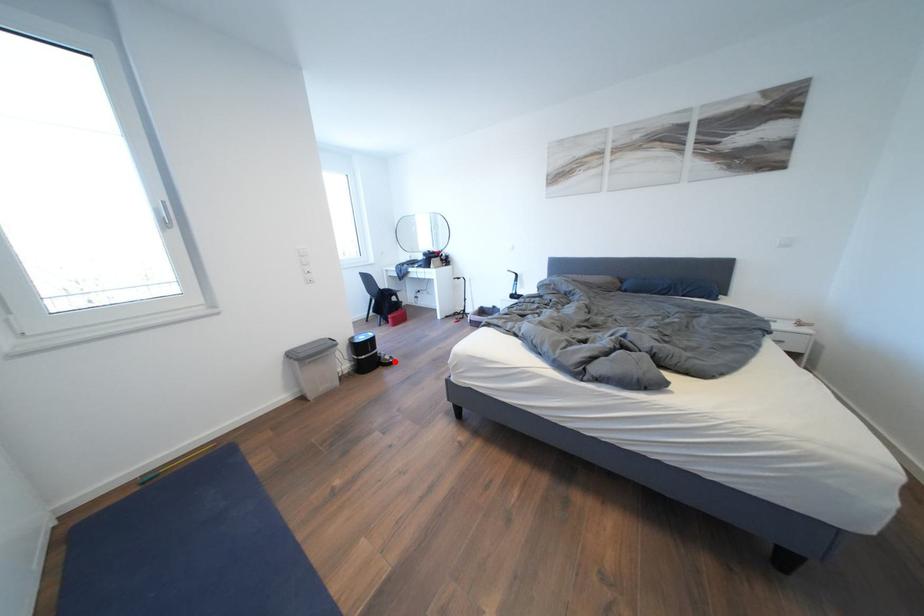
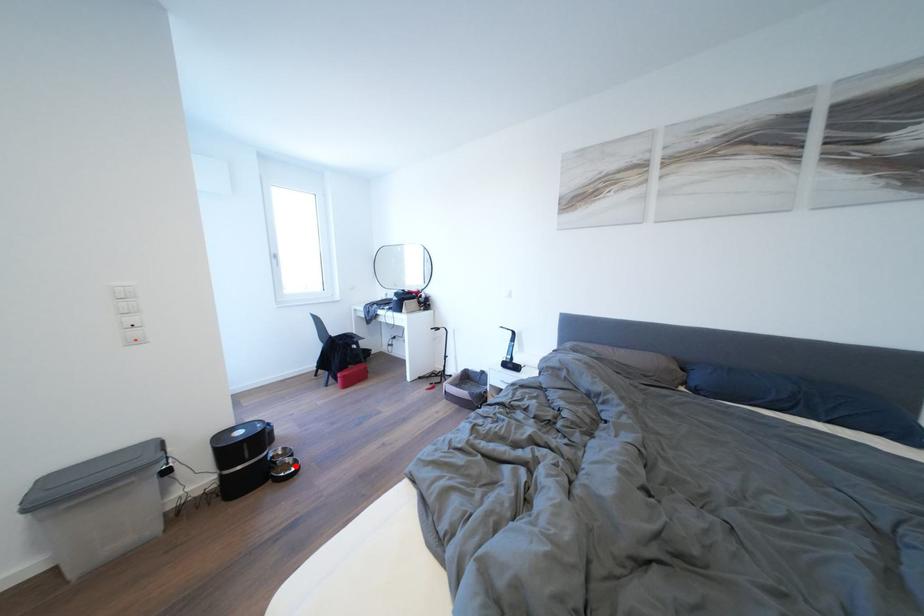
I am providing you with two images of the same scene from different viewpoints. A red point is marked on the first image and another point is marked on the second image. Do the highlighted points in image1 and image2 indicate the same real-world spot?

Yes